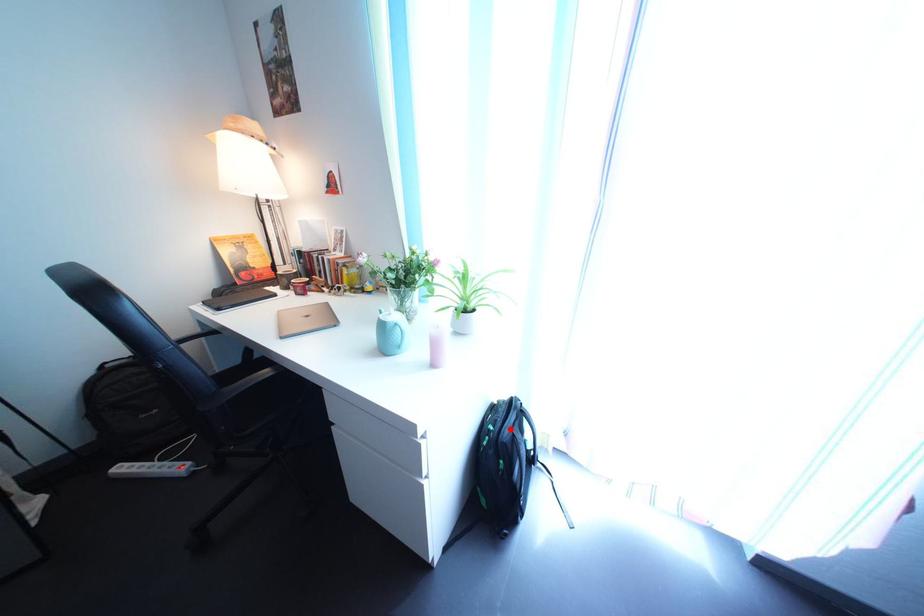
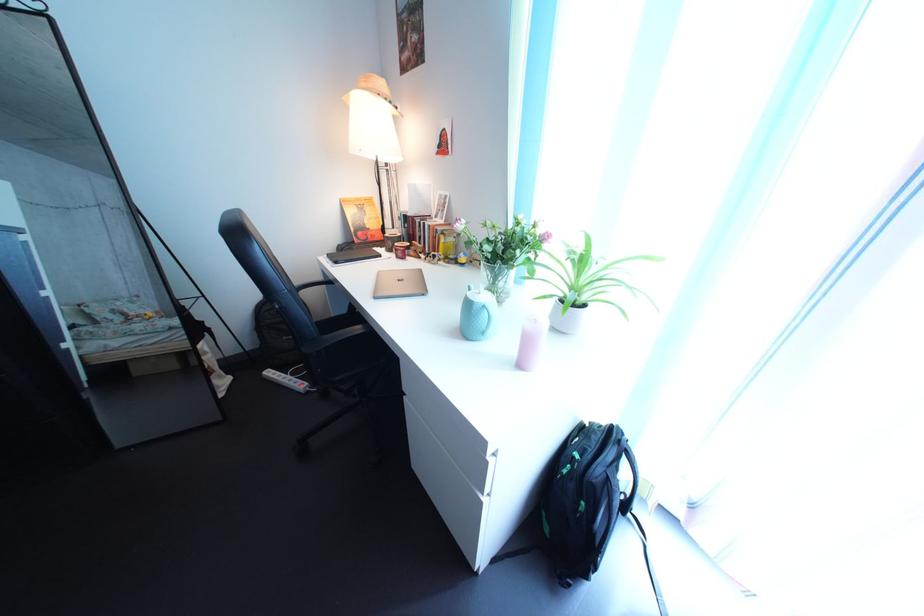
Question: I am providing you with two images of the same scene from different viewpoints. A red point is marked on the first image. Is the red point's position out of view in image 2?

Choices:
 (A) Yes
 (B) No

Answer: (B)